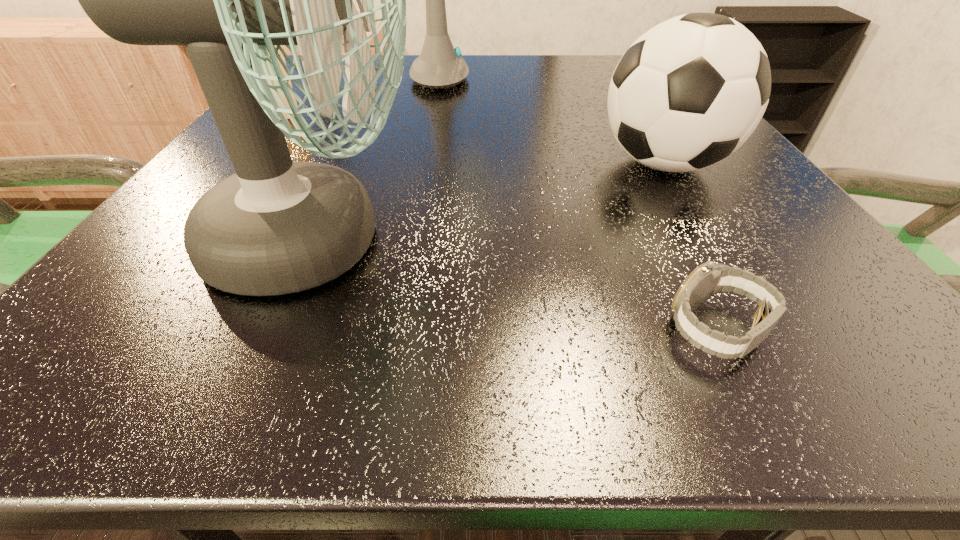
Identify the location of the farther fan. tap(440, 65).

What are the coordinates of `the nearer fan` in the screenshot? It's located at (276, 227).

The height and width of the screenshot is (540, 960). I want to click on soccer ball, so point(689,92).

Find the location of a particular element. The width and height of the screenshot is (960, 540). the fourth tallest object is located at coordinates (284, 72).

Locate an element on the screen. candle is located at coordinates (284, 72).

Identify the location of watch. 709,278.

At what (x,y) coordinates should I click in order to perform the action: click on vacant region located 0.310m on the front-facing side of the farther fan. Please return your answer as a coordinate pair (x, y). Looking at the image, I should click on (636, 80).

I want to click on vacant space situated 0.370m in front of the nearer fan where the airflow is directed, so click(x=732, y=242).

The image size is (960, 540). Identify the location of vacant space situated 0.320m on the left of the soccer ball. (389, 164).

At what (x,y) coordinates should I click in order to perform the action: click on vacant space located on the right of the candle. Please return your answer as a coordinate pair (x, y). Looking at the image, I should click on (469, 114).